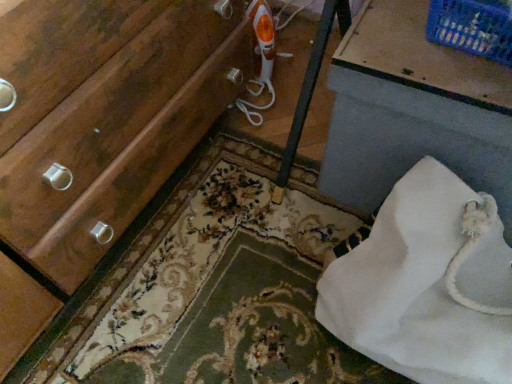
What do you see at coordinates (210, 285) in the screenshot? I see `floral carpet at lower center` at bounding box center [210, 285].

What is the approximate width of blue plastic basket at upper right?

blue plastic basket at upper right is 7.51 inches in width.

I want to click on floral carpet at lower center, so click(210, 285).

Does point (456, 85) appear closer or farther from the camera than point (485, 16)?

Clearly, point (456, 85) is more distant from the camera than point (485, 16).

From a real-world perspective, between white fabric bag at lower right and blue plastic basket at upper right, who is vertically lower?

In real-world perspective, white fabric bag at lower right is lower.

Is white fabric bag at lower right not close to blue plastic basket at upper right?

That's not correct — white fabric bag at lower right is a little close to blue plastic basket at upper right.

Does white fabric bag at lower right lie in front of blue plastic basket at upper right?

That is True.

Find the location of a particular element. Image resolution: width=512 pixels, height=384 pixels. basket that appears above the white fabric bag at lower right (from a real-world perspective) is located at coordinates (472, 27).

From the image's perspective, is blue plastic basket at upper right over white fabric bag at lower right?

Yes, from the image's perspective, blue plastic basket at upper right is over white fabric bag at lower right.

From their relative heights in the image, would you say blue plastic basket at upper right is taller or shorter than white fabric bag at lower right?

blue plastic basket at upper right is shorter than white fabric bag at lower right.

Is blue plastic basket at upper right positioned beyond the bounds of white fabric bag at lower right?

Absolutely, blue plastic basket at upper right is external to white fabric bag at lower right.

Which object is thinner, floral carpet at lower center or white fabric bag at lower right?

white fabric bag at lower right is thinner.

From the picture: From a real-world perspective, is floral carpet at lower center physically above white fabric bag at lower right?

No, from a real-world perspective, floral carpet at lower center is not over white fabric bag at lower right

Considering the positions of objects floral carpet at lower center and white fabric bag at lower right in the image provided, who is more to the right, floral carpet at lower center or white fabric bag at lower right?

white fabric bag at lower right.

Between floral carpet at lower center and white fabric bag at lower right, which one has smaller size?

floral carpet at lower center is smaller.

Find the location of a particular element. bath mat on the left of the blue plastic basket at upper right is located at coordinates (210, 285).

Would you say floral carpet at lower center is a long distance from blue plastic basket at upper right?

floral carpet at lower center is actually quite close to blue plastic basket at upper right.

Considering the relative sizes of floral carpet at lower center and blue plastic basket at upper right in the image provided, is floral carpet at lower center bigger than blue plastic basket at upper right?

Indeed, floral carpet at lower center has a larger size compared to blue plastic basket at upper right.

Looking at the image, does blue plastic basket at upper right seem bigger or smaller compared to floral carpet at lower center?

Considering their sizes, blue plastic basket at upper right takes up less space than floral carpet at lower center.

Between point (494, 14) and point (46, 377), which one is positioned in front?

The point (494, 14) is closer.

From the image's perspective, which one is positioned higher, blue plastic basket at upper right or floral carpet at lower center?

From the image's view, blue plastic basket at upper right is above.

How distant is blue plastic basket at upper right from floral carpet at lower center?

blue plastic basket at upper right is 23.23 inches from floral carpet at lower center.

Identify the location of bath mat below the white fabric bag at lower right (from a real-world perspective). Image resolution: width=512 pixels, height=384 pixels. (210, 285).

From a real-world perspective, which object stands above the other?

white fabric bag at lower right.

Which of these two, white fabric bag at lower right or floral carpet at lower center, is bigger?

white fabric bag at lower right.

Do you think white fabric bag at lower right is within floral carpet at lower center, or outside of it?

white fabric bag at lower right is spatially situated outside floral carpet at lower center.

Find the location of a particular element. This screenshot has width=512, height=384. basket located above the white fabric bag at lower right (from the image's perspective) is located at coordinates (472, 27).

Where is `vanity below the blue plastic basket at upper right (from the image's perspective)`? Image resolution: width=512 pixels, height=384 pixels. vanity below the blue plastic basket at upper right (from the image's perspective) is located at coordinates (412, 109).

Estimate the real-world distances between objects in this image. Which object is further from floral carpet at lower center, white fabric bag at lower right or blue plastic basket at upper right?

Based on the image, blue plastic basket at upper right appears to be further to floral carpet at lower center.

Based on their spatial positions, is floral carpet at lower center or white fabric bag at lower right closer to blue plastic basket at upper right?

white fabric bag at lower right lies closer to blue plastic basket at upper right than the other object.

Estimate the real-world distances between objects in this image. Which object is further from floral carpet at lower center, blue plastic basket at upper right or white fabric bag at lower right?

blue plastic basket at upper right is positioned further to the anchor floral carpet at lower center.

When comparing their distances from blue plastic basket at upper right, does white fabric bag at lower right or floral carpet at lower center seem further?

Based on the image, floral carpet at lower center appears to be further to blue plastic basket at upper right.

Looking at the image, which one is located further to white fabric bag at lower right, blue plastic basket at upper right or floral carpet at lower center?

floral carpet at lower center.

Considering their positions, is floral carpet at lower center positioned further to white fabric bag at lower right than blue plastic basket at upper right?

floral carpet at lower center is further to white fabric bag at lower right.

Image resolution: width=512 pixels, height=384 pixels. What are the coordinates of `basket between floral carpet at lower center and white fabric bag at lower right from left to right` in the screenshot? It's located at (472, 27).